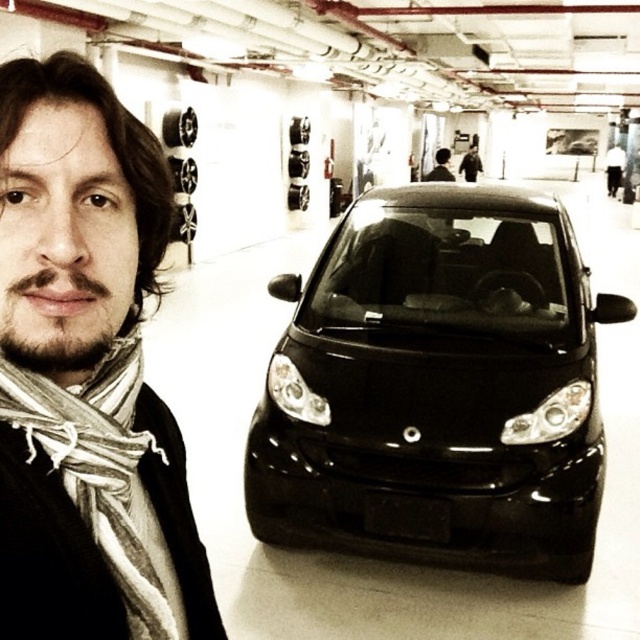
Locate an element on the screen. The height and width of the screenshot is (640, 640). glossy black car at center is located at coordinates (436, 388).

Can you confirm if glossy black car at center is smaller than white striped scarf at left?

No, glossy black car at center is not smaller than white striped scarf at left.

Where is `glossy black car at center`? The width and height of the screenshot is (640, 640). glossy black car at center is located at coordinates (436, 388).

Identify the location of glossy black car at center. The image size is (640, 640). (436, 388).

Is matte scarf at left smaller than white striped scarf at left?

No.

Can you confirm if matte scarf at left is positioned to the left of white striped scarf at left?

Correct, you'll find matte scarf at left to the left of white striped scarf at left.

Who is more forward, (156, 502) or (90, 497)?

Positioned in front is point (90, 497).

Where is `matte scarf at left`? The height and width of the screenshot is (640, 640). matte scarf at left is located at coordinates (86, 372).

Is glossy black car at center behind matte black car at center?

No, it is in front of matte black car at center.

Is point (529, 236) farther from viewer compared to point (445, 168)?

No, (529, 236) is closer to viewer.

I want to click on glossy black car at center, so click(436, 388).